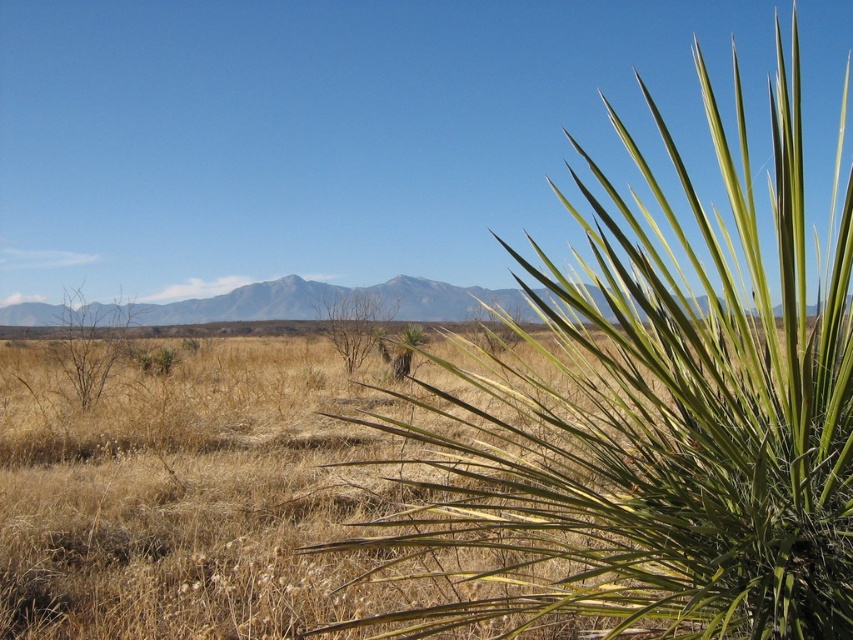
Question: Is brown dry bush at left bigger than brown dry at center?

Choices:
 (A) no
 (B) yes

Answer: (A)

Question: Which point is closer to the camera?

Choices:
 (A) green leafy plant at right
 (B) brown dry at center

Answer: (A)

Question: Among these points, which one is nearest to the camera?

Choices:
 (A) (750, 259)
 (B) (57, 342)

Answer: (A)

Question: Can you confirm if green leafy plant at right is positioned to the right of brown dry bush at left?

Choices:
 (A) no
 (B) yes

Answer: (B)

Question: From the image, what is the correct spatial relationship of brown dry bush at left in relation to brown dry at center?

Choices:
 (A) above
 (B) below

Answer: (B)

Question: Which point is farther to the camera?

Choices:
 (A) (354, 356)
 (B) (437, 522)
 (C) (62, 340)

Answer: (A)